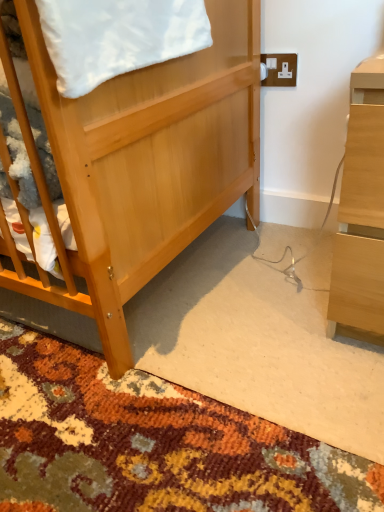
In order to click on vacant point to the left of light wood desk at right in this screenshot , I will do `click(250, 301)`.